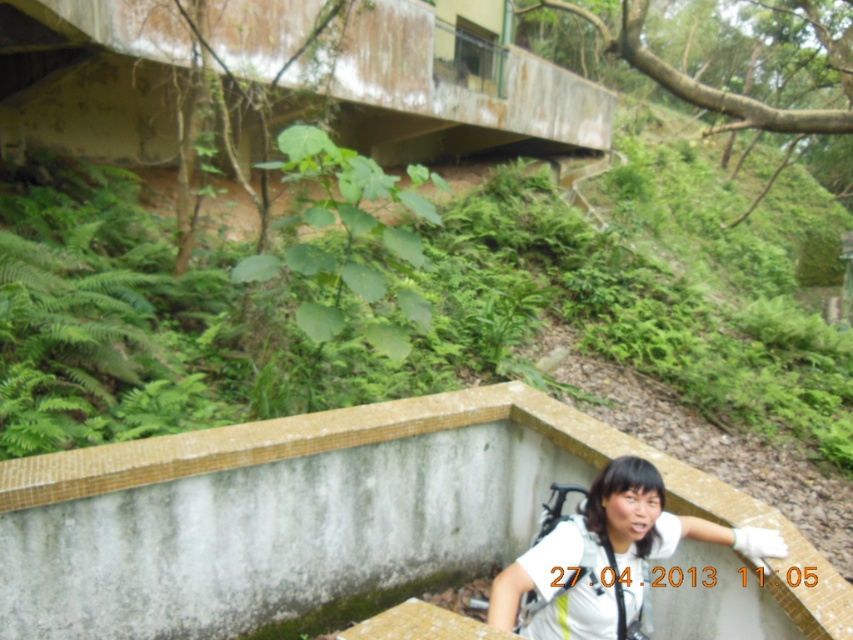
You are a drone operator trying to capture a photo of the person sitting on the concrete structure. You need to ensure that both points, point (335,433) and point (505,586), are visible in the frame. Which point is closer to the camera so that you can adjust your angle accordingly?

Point (335,433) is closer to the camera than point (505,586). Therefore, to ensure both points are visible, you should position the camera so that it captures the closer point first and then adjust the angle to include the farther one.

Based on the scene description, where is the white mosaic ledge at lower center located in the image?

The white mosaic ledge at lower center is located at the 2D coordinates point (352,522).